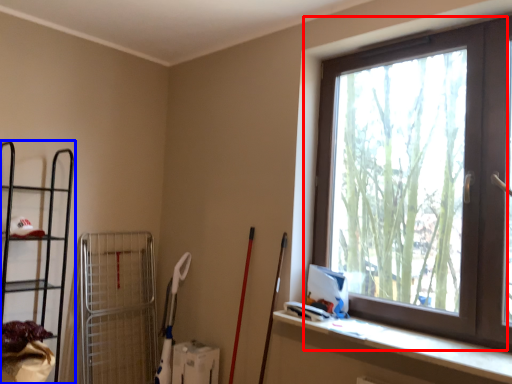
Question: Which object is further to the camera taking this photo, window (highlighted by a red box) or shelf (highlighted by a blue box)?

Choices:
 (A) window
 (B) shelf

Answer: (B)